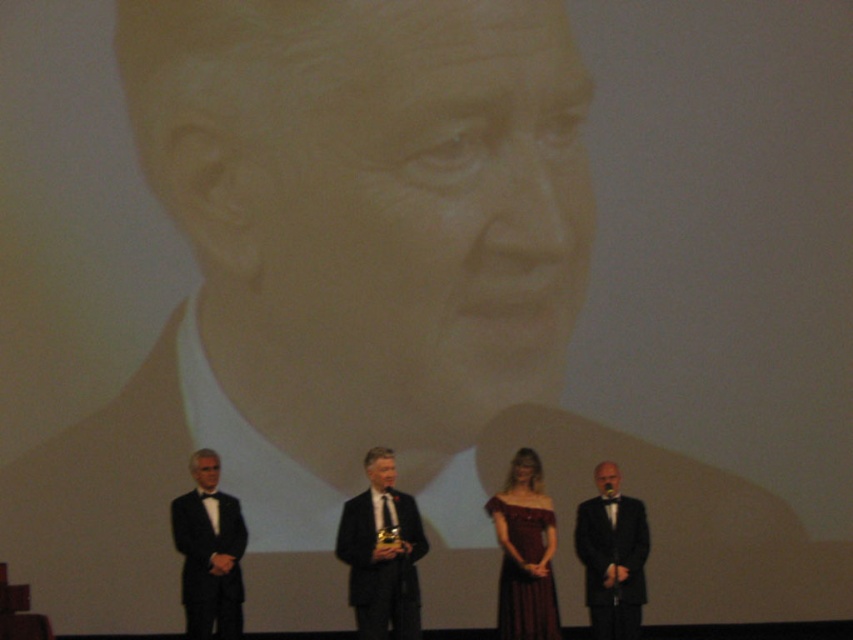
You are standing on the stage and want to move to the right to adjust the lighting. There is a point marked at coordinates point (209, 552) which is the location of the black satin suit at left. Can you safely move to the right from your current position without stepping on the black satin suit at left?

The point (209, 552) marks the location of the black satin suit at left. Since you want to move to the right, you can safely move away from the black satin suit at left as long as you don not step directly on its location.